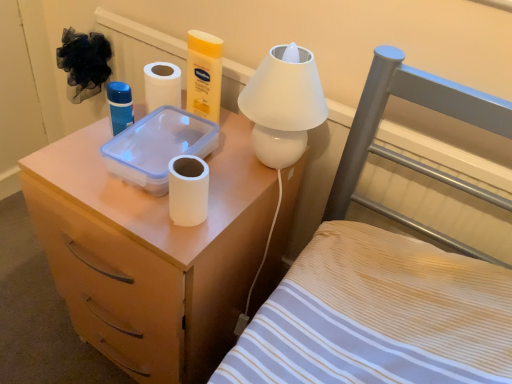
Locate an element on the screen. This screenshot has width=512, height=384. vacant space in front of white glossy table lamp at upper center is located at coordinates pos(218,203).